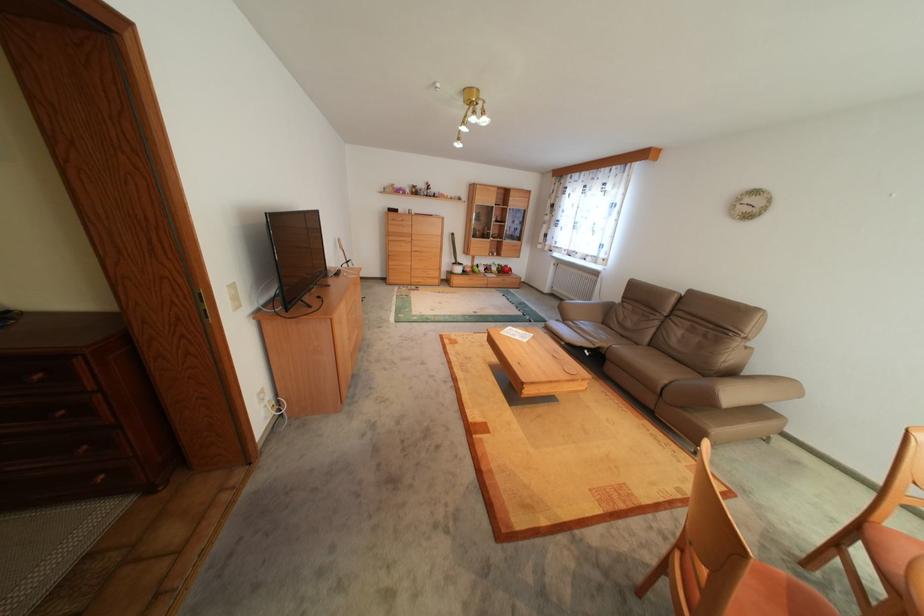
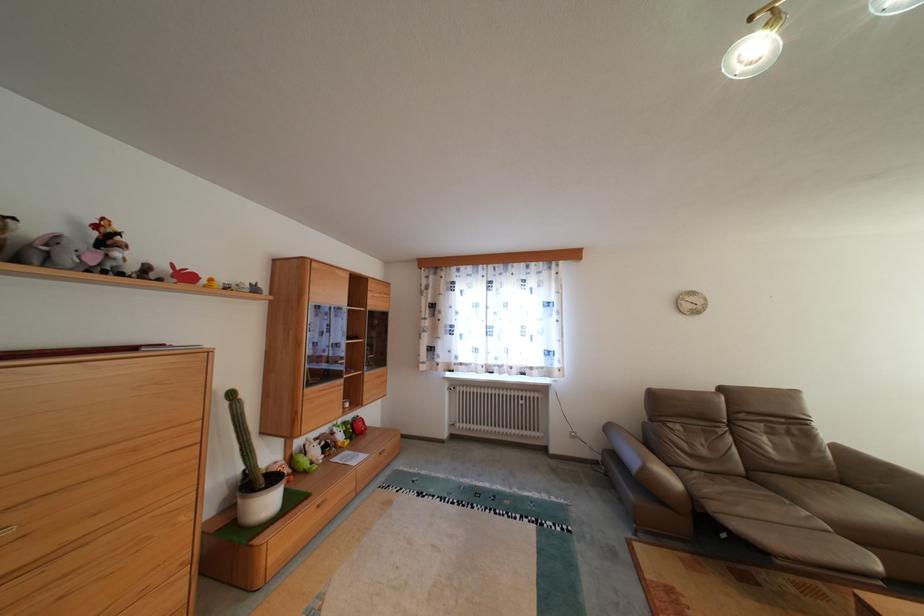
The point at (453, 195) is marked in the first image. Where is the corresponding point in the second image?

(198, 277)